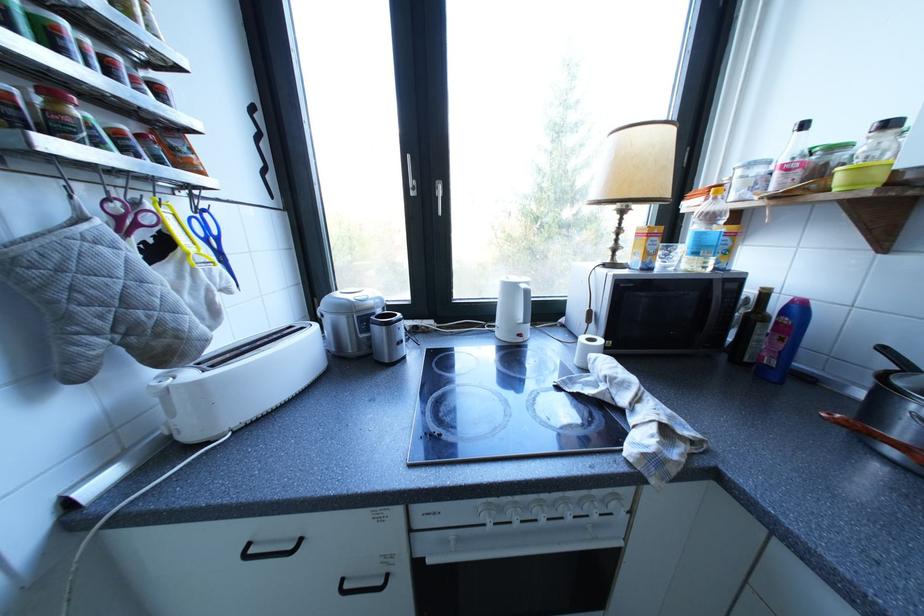
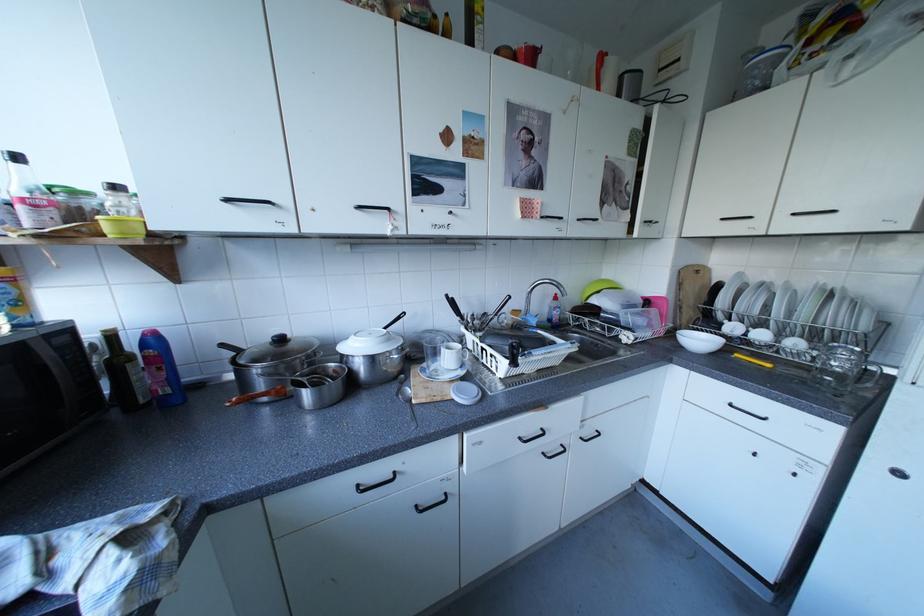
How did the camera likely rotate?

The camera's rotation is toward right-down.